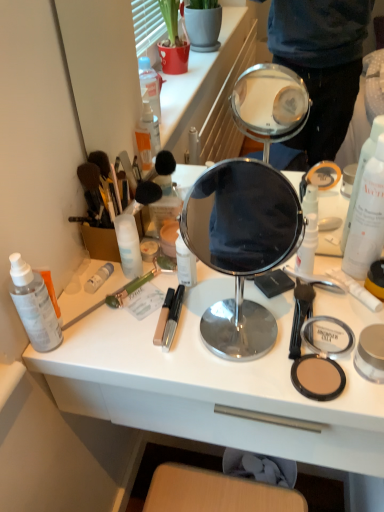
This screenshot has height=512, width=384. I want to click on empty space that is to the right of translucent plastic spray bottle at left, marked as the 5th toiletry in a right-to-left arrangement, so click(152, 329).